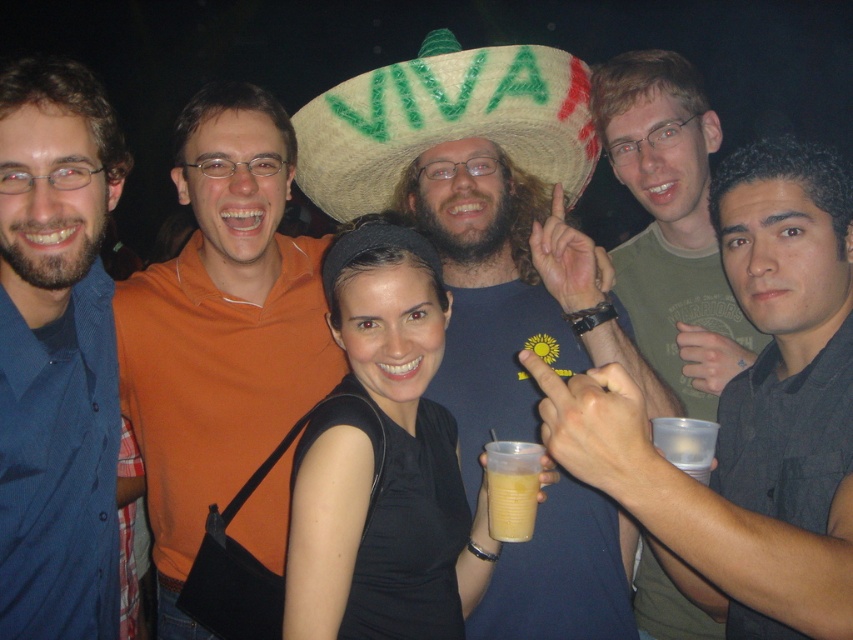
Which is more to the left, blue button-down shirt at left or straw hat at center?

Positioned to the left is blue button-down shirt at left.

Who is positioned more to the right, blue button-down shirt at left or straw hat at center?

From the viewer's perspective, straw hat at center appears more on the right side.

Is point (73, 166) farther from viewer compared to point (386, 205)?

No, it is in front of (386, 205).

Find the location of a particular element. The image size is (853, 640). blue button-down shirt at left is located at coordinates (56, 353).

Between matte green t-shirt at center and yellow translucent cup at center, which one appears on the left side from the viewer's perspective?

Positioned to the left is yellow translucent cup at center.

Which is behind, point (804, 433) or point (495, 522)?

The point (495, 522) is behind.

The image size is (853, 640). I want to click on matte green t-shirt at center, so click(747, 413).

Can you confirm if matte green t-shirt at center is shorter than straw hat at center?

No.

Measure the distance between matte green t-shirt at center and camera.

A distance of 30.50 inches exists between matte green t-shirt at center and camera.

Does point (838, 416) come farther from viewer compared to point (581, 150)?

No, it is in front of (581, 150).

I want to click on matte green t-shirt at center, so click(x=747, y=413).